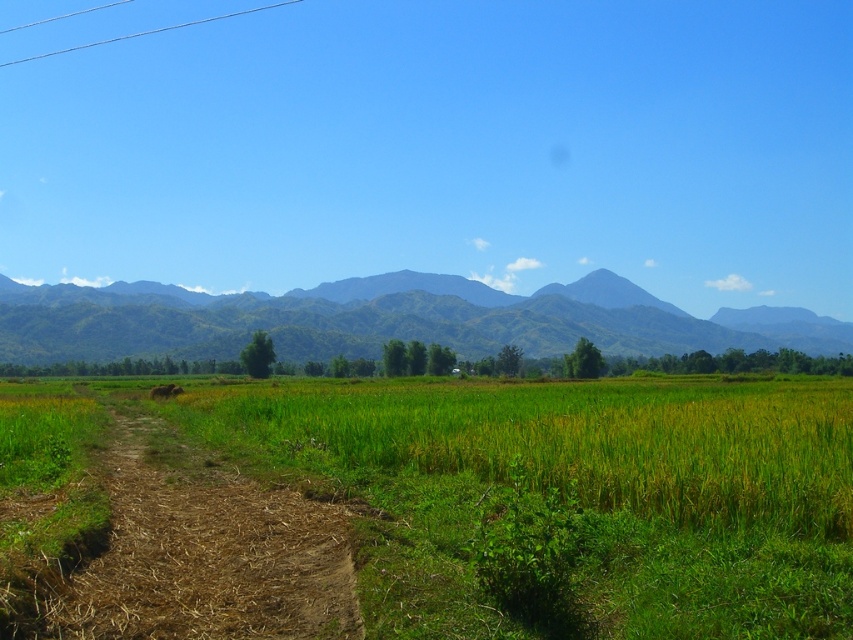
Does green leafy mountain at center have a greater width compared to brown dirt track at lower left?

Yes, green leafy mountain at center is wider than brown dirt track at lower left.

Who is more forward, (445,278) or (213,540)?

Positioned in front is point (213,540).

In order to click on green leafy mountain at center in this screenshot , I will do `click(386, 320)`.

Can you confirm if green grassy field at center is taller than brown dirt track at lower left?

Yes.

Who is lower down, green grassy field at center or brown dirt track at lower left?

green grassy field at center is below.

Describe the element at coordinates (569, 492) in the screenshot. I see `green grassy field at center` at that location.

I want to click on green grassy field at center, so click(x=569, y=492).

Is point (408, 541) farther from viewer compared to point (44, 326)?

No, (408, 541) is in front of (44, 326).

Find the location of `green grassy field at center`. green grassy field at center is located at coordinates (569, 492).

The height and width of the screenshot is (640, 853). What do you see at coordinates (569, 492) in the screenshot?
I see `green grassy field at center` at bounding box center [569, 492].

This screenshot has width=853, height=640. Find the location of `green grassy field at center`. green grassy field at center is located at coordinates (569, 492).